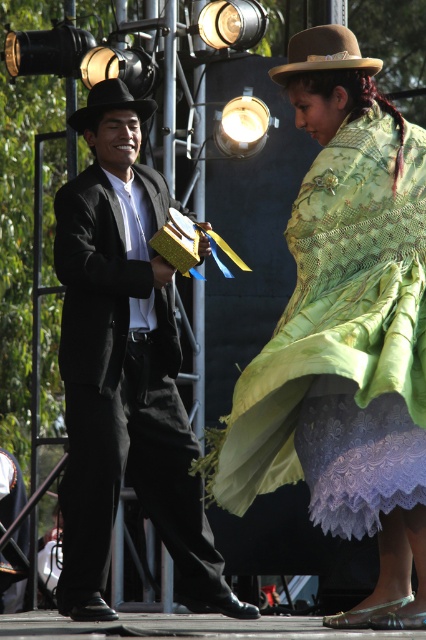
Is point (356, 52) positioned before point (71, 124)?

Yes, point (356, 52) is in front of point (71, 124).

Between brown felt hat at upper center and black felt cowboy hat at left, which one appears on the left side from the viewer's perspective?

Positioned to the left is black felt cowboy hat at left.

Does point (376, 65) lie in front of point (95, 96)?

Yes.

In order to click on brown felt hat at upper center in this screenshot , I will do `click(324, 52)`.

Which of these two, matte black suit at center or black felt cowboy hat at left, stands taller?

matte black suit at center

Is matte black suit at center taller than black felt cowboy hat at left?

Indeed, matte black suit at center has a greater height compared to black felt cowboy hat at left.

What do you see at coordinates (124, 380) in the screenshot? I see `matte black suit at center` at bounding box center [124, 380].

Where is `matte black suit at center`? Image resolution: width=426 pixels, height=640 pixels. matte black suit at center is located at coordinates (124, 380).

Is matte black suit at center further to the viewer compared to brown felt hat at upper center?

That is True.

Where is `matte black suit at center`? This screenshot has width=426, height=640. matte black suit at center is located at coordinates (124, 380).

Where is `matte black suit at center`? matte black suit at center is located at coordinates (124, 380).